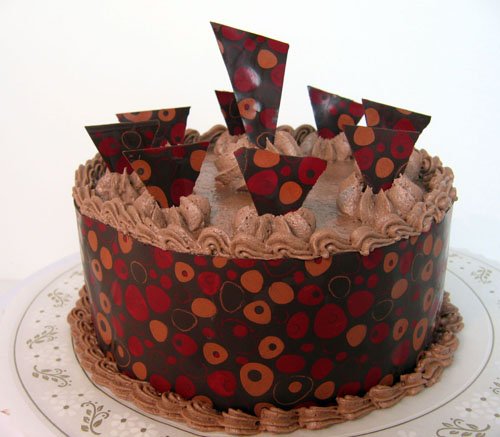
Where is `plate`? This screenshot has width=500, height=437. plate is located at coordinates (416, 397).